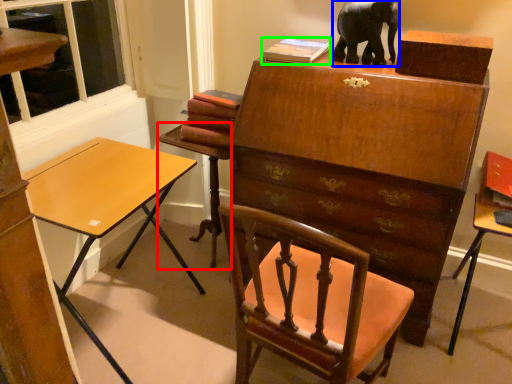
Question: Which object is positioned farthest from table (highlighted by a red box)? Select from elephant (highlighted by a blue box) and book (highlighted by a green box).

Choices:
 (A) elephant
 (B) book

Answer: (A)